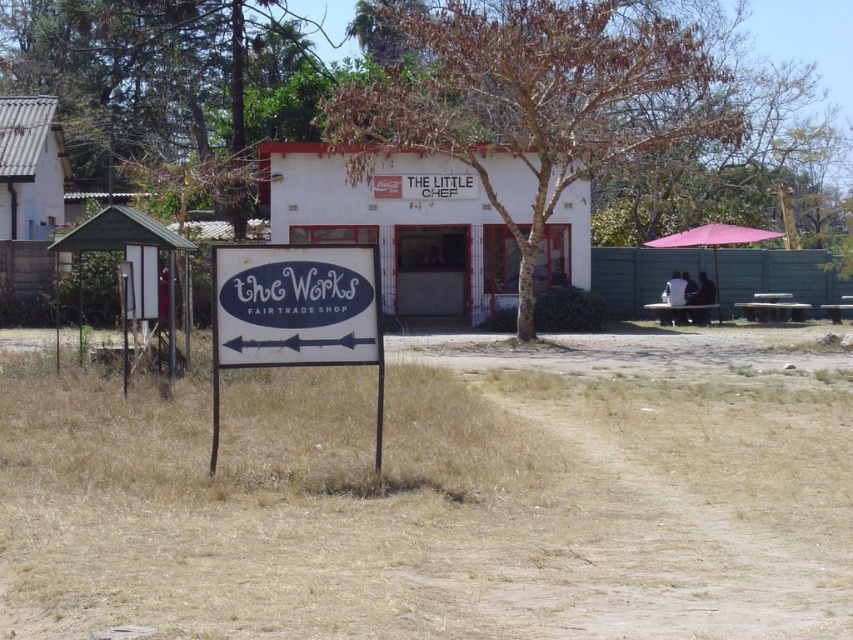
Question: Is white plastic sign at center positioned before pink fabric umbrella at right?

Choices:
 (A) no
 (B) yes

Answer: (B)

Question: Is the position of white plastic sign at center less distant than that of pink fabric umbrella at right?

Choices:
 (A) yes
 (B) no

Answer: (A)

Question: Which object is farther from the camera taking this photo?

Choices:
 (A) pink fabric umbrella at right
 (B) brown dry grass at center
 (C) white plastic sign at center

Answer: (A)

Question: Which object is farther from the camera taking this photo?

Choices:
 (A) pink fabric umbrella at right
 (B) brown dry grass at center

Answer: (A)

Question: Which of the following is the closest to the observer?

Choices:
 (A) brown dry grass at center
 (B) pink fabric umbrella at right

Answer: (A)

Question: In this image, where is brown dry grass at center located relative to white plastic sign at center?

Choices:
 (A) left
 (B) right

Answer: (B)